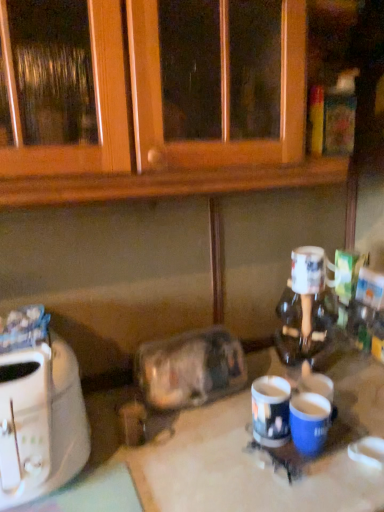
The height and width of the screenshot is (512, 384). I want to click on vacant position to the left of blue glossy mug at center, positioned as the second coffee cup in bottom-to-top order, so click(200, 442).